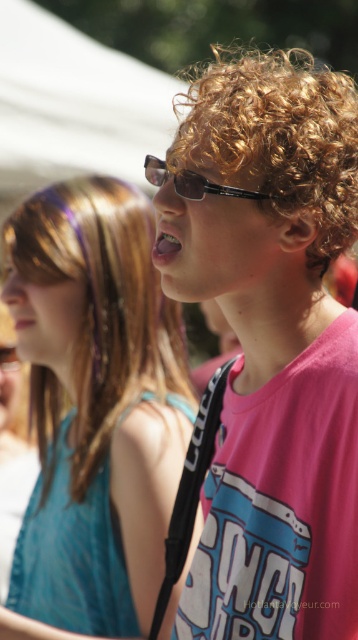
You are designing a layout for a clothing catalog and need to place two pink matte shirts. The pink matte shirt at center and the pink matte shirt at upper right. Based on their sizes, which one should be placed in a position that requires a wider display area?

The pink matte shirt at upper right should be placed in the position requiring a wider display area because it has a greater width than the pink matte shirt at center.

You are a photographer trying to capture a clear shot of both the pink matte shirt at upper right and the curly golden hair at center. Since the camera can only focus on one subject at a time, which subject should you focus on to ensure the larger one is sharp?

The pink matte shirt at upper right is larger in size than the curly golden hair at center, so you should focus on the pink matte shirt at upper right to ensure the larger subject is sharp.